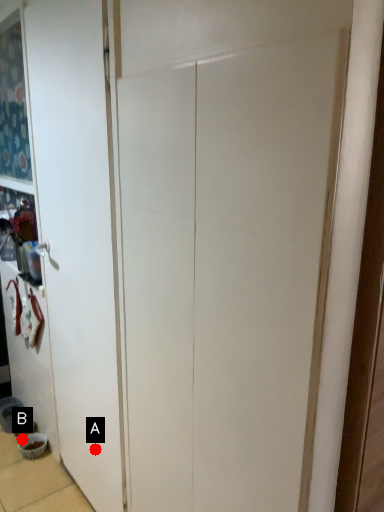
Question: Two points are circled on the image, labeled by A and B beside each circle. Which point appears closest to the camera in this image?

Choices:
 (A) A is closer
 (B) B is closer

Answer: (A)